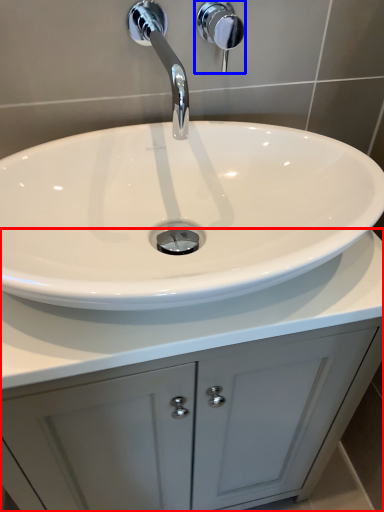
Question: Which point is further to the camera, bathroom cabinet (highlighted by a red box) or shower (highlighted by a blue box)?

Choices:
 (A) bathroom cabinet
 (B) shower

Answer: (B)